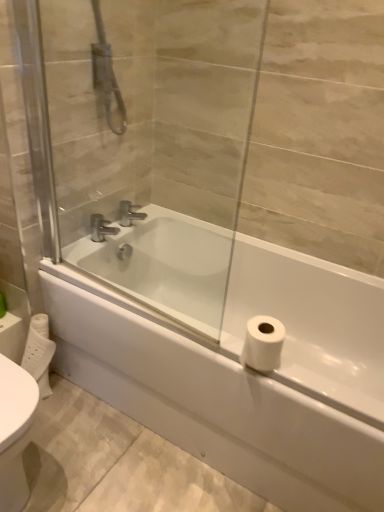
Question: Considering the positions of transparent glass screen door at upper center and chrome metallic faucet at upper center, which appears as the second tap when viewed from the left, in the image, is transparent glass screen door at upper center taller or shorter than chrome metallic faucet at upper center, which appears as the second tap when viewed from the left,?

Choices:
 (A) tall
 (B) short

Answer: (A)

Question: Looking at the image, does transparent glass screen door at upper center seem bigger or smaller compared to chrome metallic faucet at upper center, which appears as the second tap when viewed from the left?

Choices:
 (A) small
 (B) big

Answer: (B)

Question: Which object is the closest to the silver metallic faucet at center, marked as the 1th tap in a left-to-right arrangement?

Choices:
 (A) chrome metallic faucet at upper center, which appears as the second tap when viewed from the left
 (B) white glossy bathtub at center
 (C) transparent glass screen door at upper center

Answer: (A)

Question: Which is nearer to the transparent glass screen door at upper center?

Choices:
 (A) silver metallic faucet at center, marked as the 1th tap in a left-to-right arrangement
 (B) chrome metallic faucet at upper center, which appears as the second tap when viewed from the left
 (C) white glossy bathtub at center

Answer: (C)